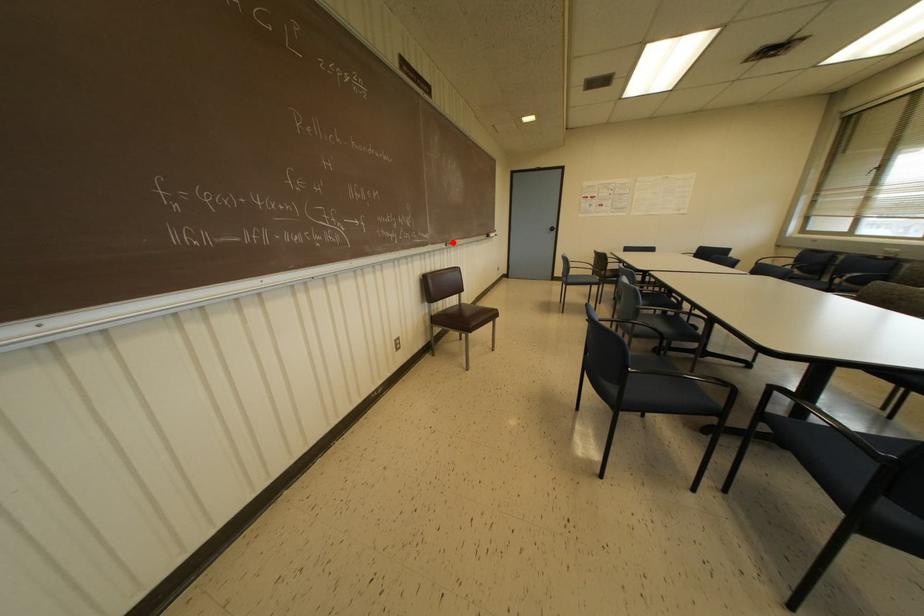
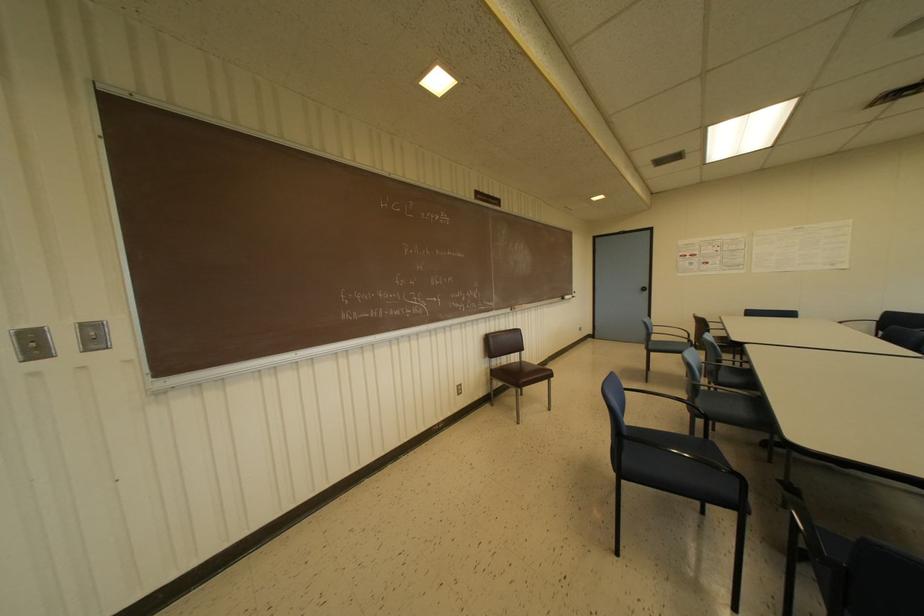
Locate, in the second image, the point that corresponds to the highlighted location in the first image.

(517, 307)